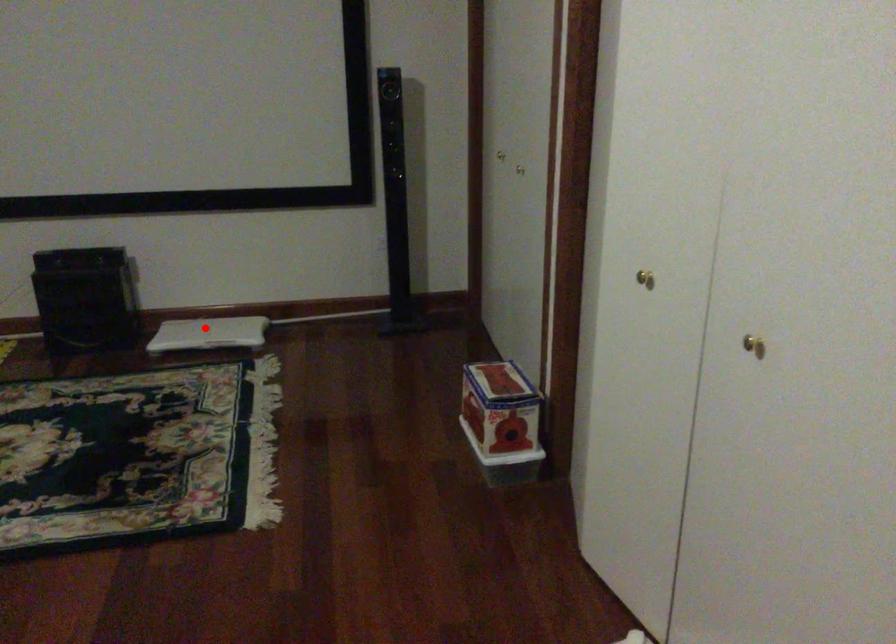
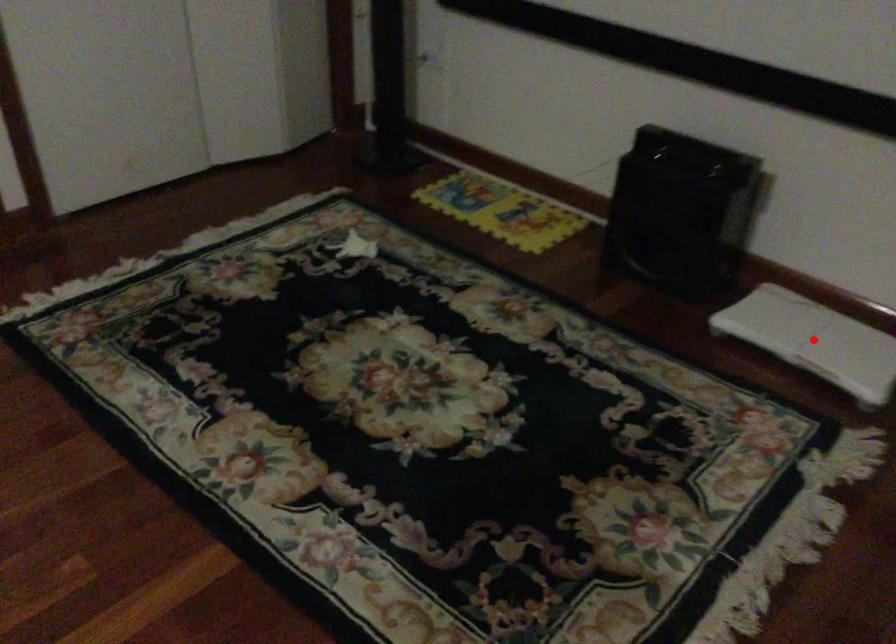
I am providing you with two images of the same scene from different viewpoints. A red point is marked on the first image and another point is marked on the second image. Are the points marked in image1 and image2 representing the same 3D position?

Yes